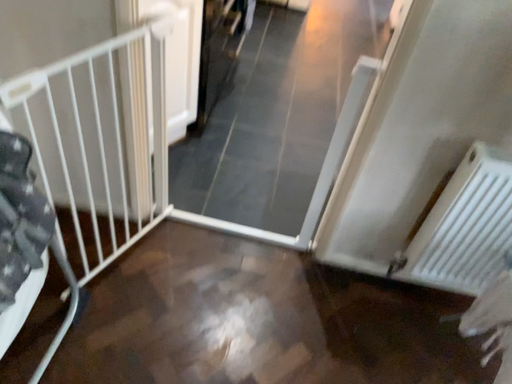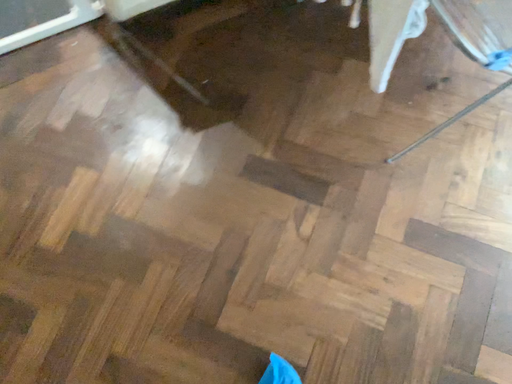
Question: Which way did the camera rotate in the video?

Choices:
 (A) rotated right
 (B) rotated left

Answer: (A)